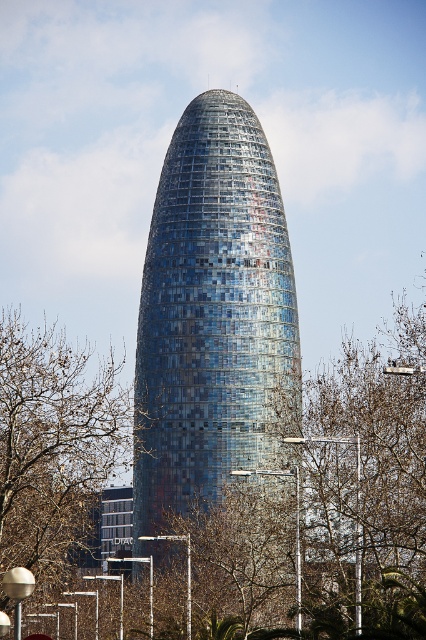
You are standing in a park and see the blue glassy tower at center and the brown leafless tree at left. Which object is closer to your left side?

The brown leafless tree at left is closer to your left side because it is positioned to the left of the blue glassy tower at center.

You are an architect analyzing the image. You need to compare the widths of the blue glassy tower at center and the brown leafless tree at left. Which one has a greater width?

The blue glassy tower at center has a greater width than the brown leafless tree at left.

You are a drone operator who needs to fly a drone from the brown leafless tree at left to the blue glassy tower at center. The drone has a maximum flight range of 30 meters. Can the drone reach the tower?

The distance between the blue glassy tower at center and the brown leafless tree at left is 30.64 meters, which exceeds the drone maximum flight range of 30 meters. Therefore, the drone cannot reach the tower.